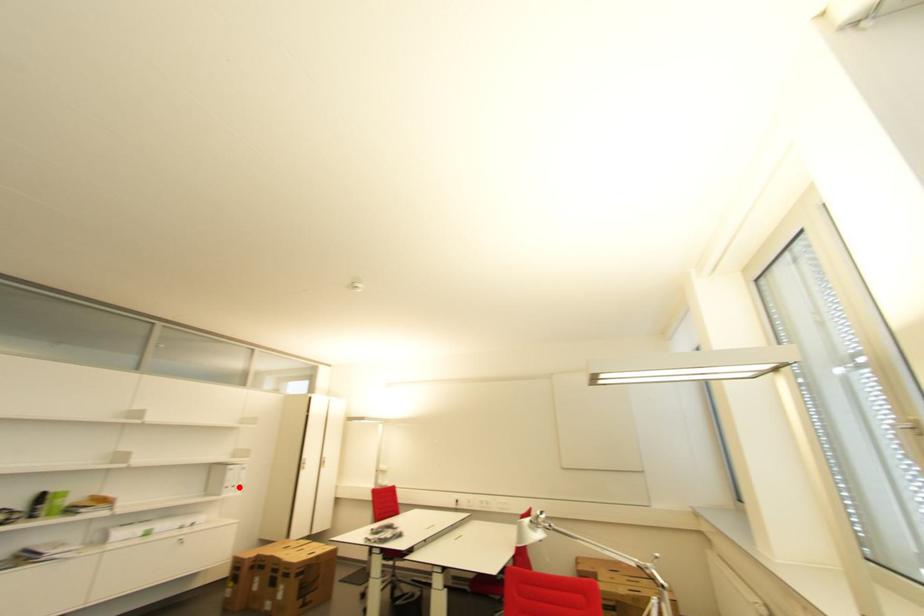
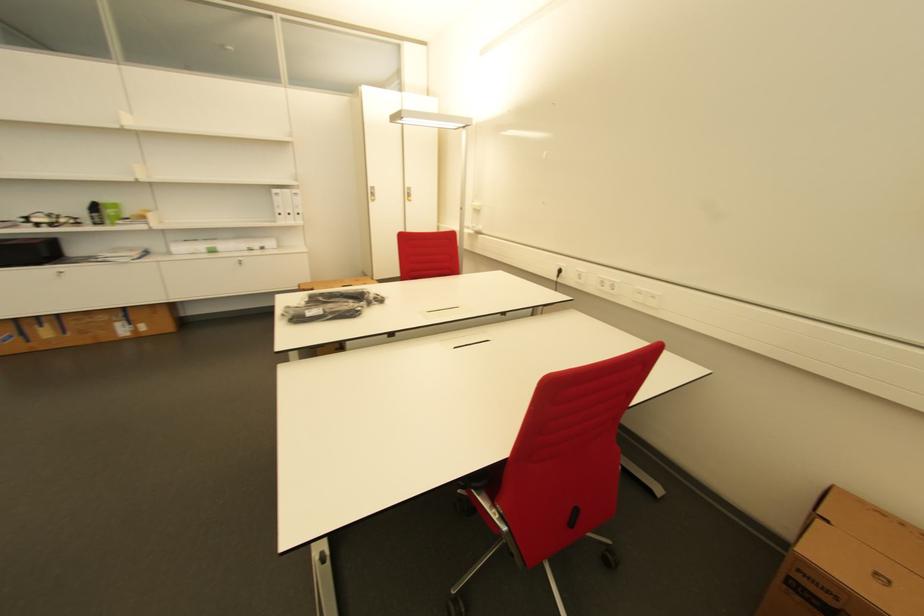
In the second image, find the point that corresponds to the highlighted location in the first image.

(294, 216)